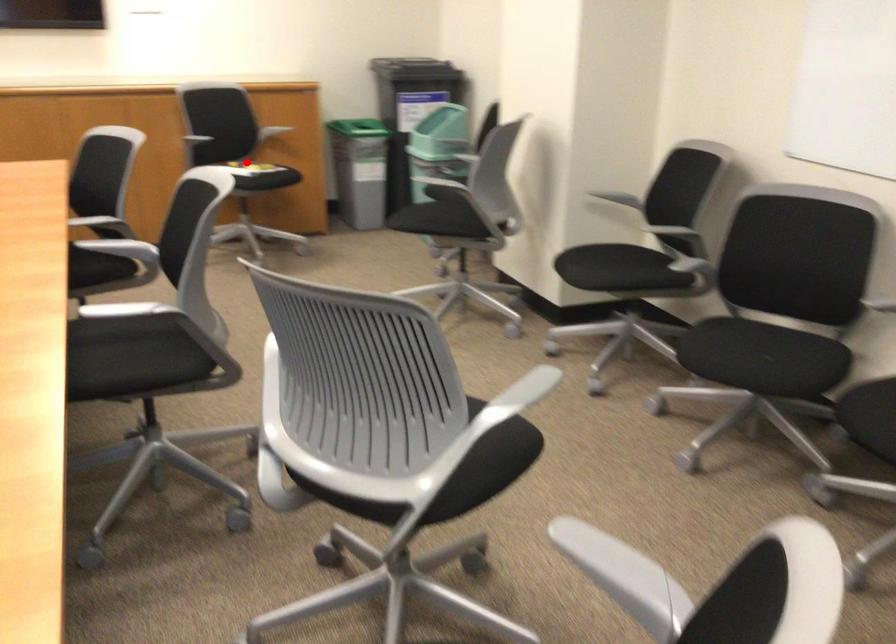
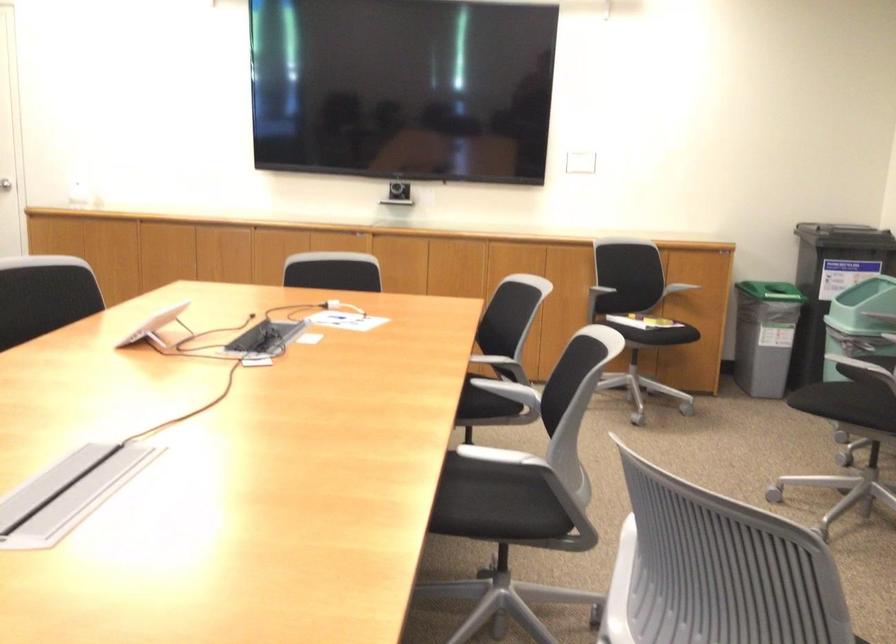
In the second image, find the point that corresponds to the highlighted location in the first image.

(636, 313)